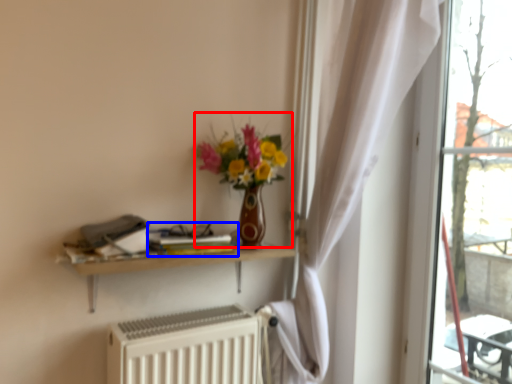
Question: Which of the following is the closest to the observer, floral arrangement (highlighted by a red box) or book (highlighted by a blue box)?

Choices:
 (A) floral arrangement
 (B) book

Answer: (A)